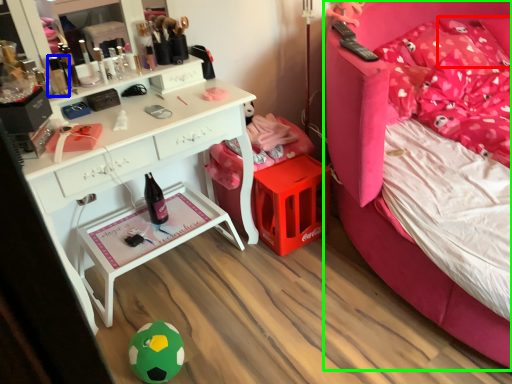
Question: Considering the real-world distances, which object is closest to pillow (highlighted by a red box)? toiletry (highlighted by a blue box) or bed (highlighted by a green box).

Choices:
 (A) toiletry
 (B) bed

Answer: (B)